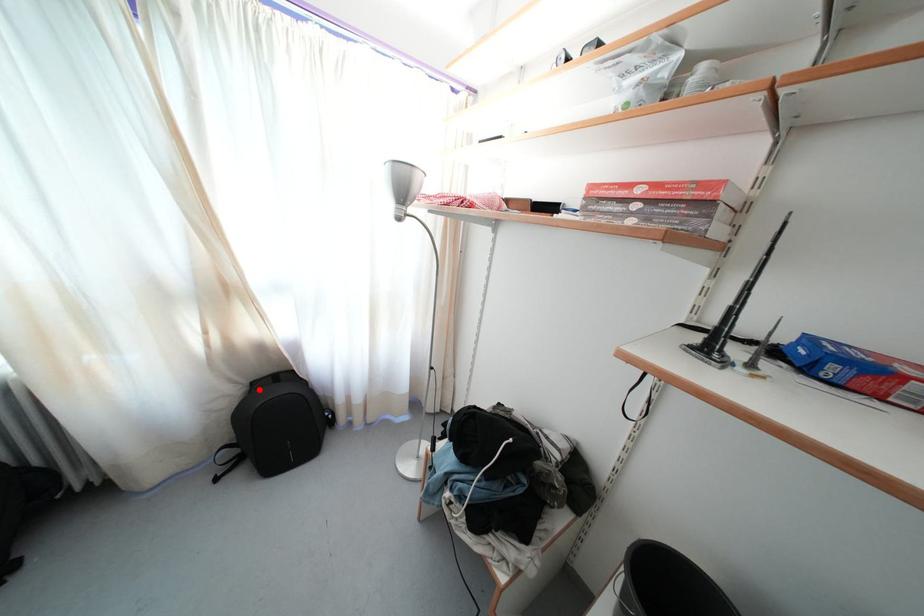
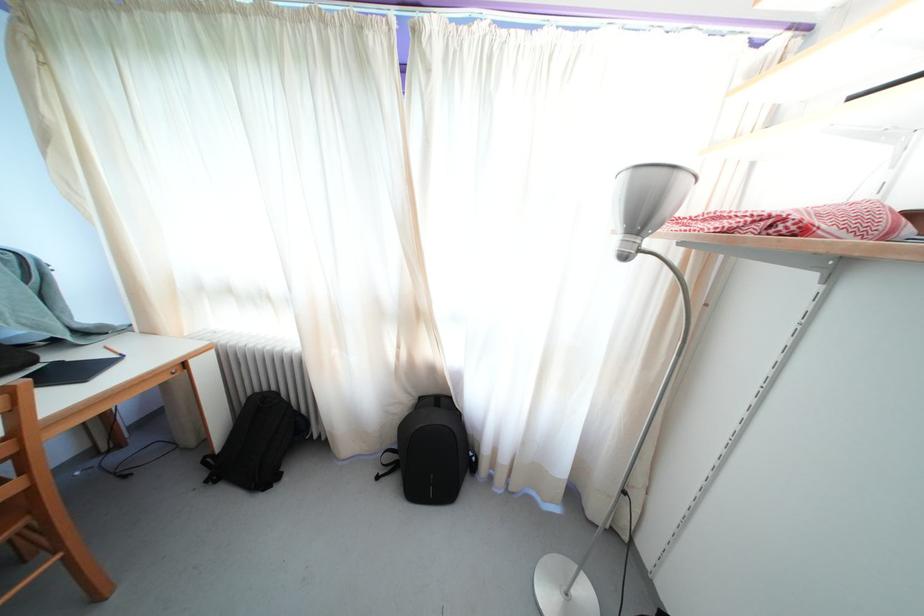
The point at the highlighted location is marked in the first image. Where is the corresponding point in the second image?

(427, 405)